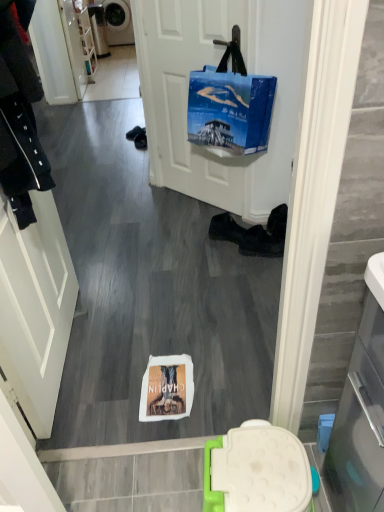
In order to click on free space behind white paper bag at center in this screenshot , I will do point(157,339).